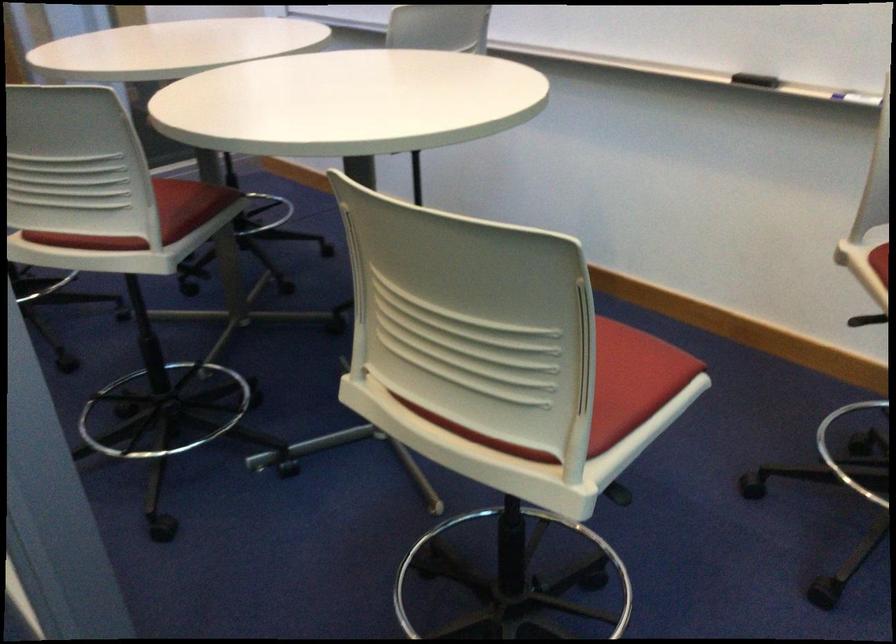
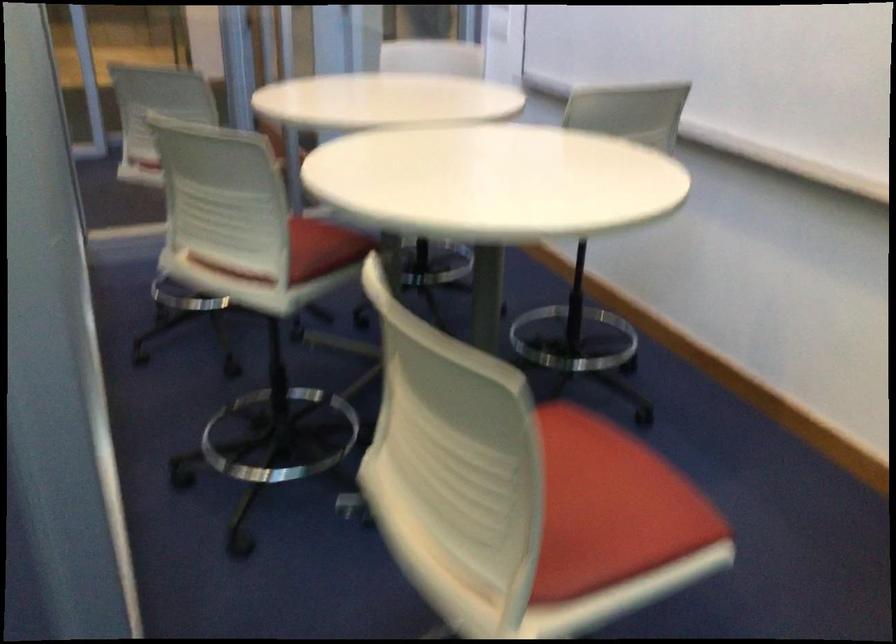
Question: The images are taken continuously from a first-person perspective. In which direction are you moving?

Choices:
 (A) Left
 (B) Right
 (C) Forward
 (D) Backward

Answer: (B)